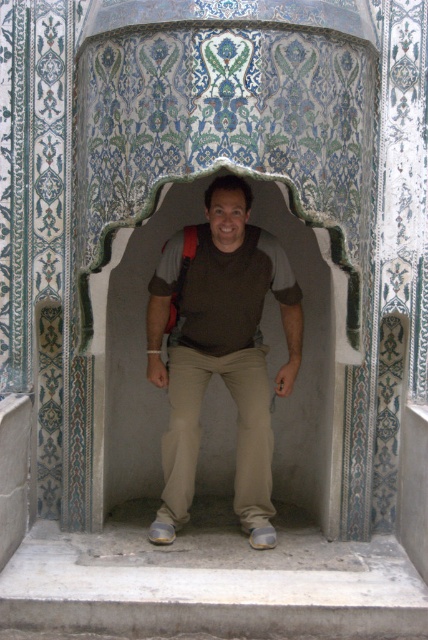
Question: In this image, where is gray concrete stairs at lower center located relative to brown matte shirt at center?

Choices:
 (A) below
 (B) above

Answer: (A)

Question: Is gray concrete stairs at lower center thinner than brown matte shirt at center?

Choices:
 (A) yes
 (B) no

Answer: (B)

Question: Among these objects, which one is nearest to the camera?

Choices:
 (A) brown matte shirt at center
 (B) gray concrete stairs at lower center

Answer: (B)

Question: Which point is farther to the camera?

Choices:
 (A) (359, 586)
 (B) (300, 321)

Answer: (B)

Question: Which point is closer to the camera?

Choices:
 (A) gray concrete stairs at lower center
 (B) brown matte shirt at center

Answer: (A)

Question: In this image, where is gray concrete stairs at lower center located relative to brown matte shirt at center?

Choices:
 (A) left
 (B) right

Answer: (A)